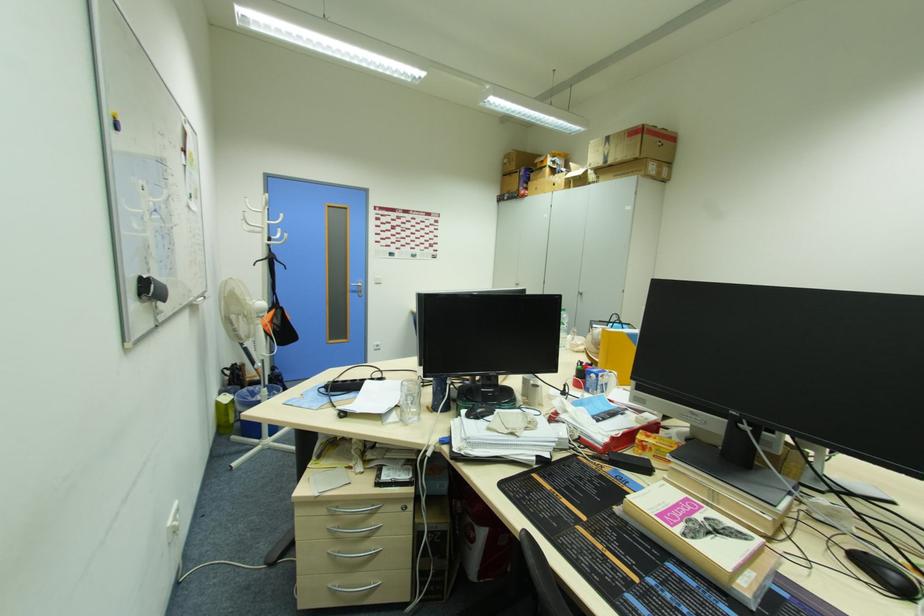
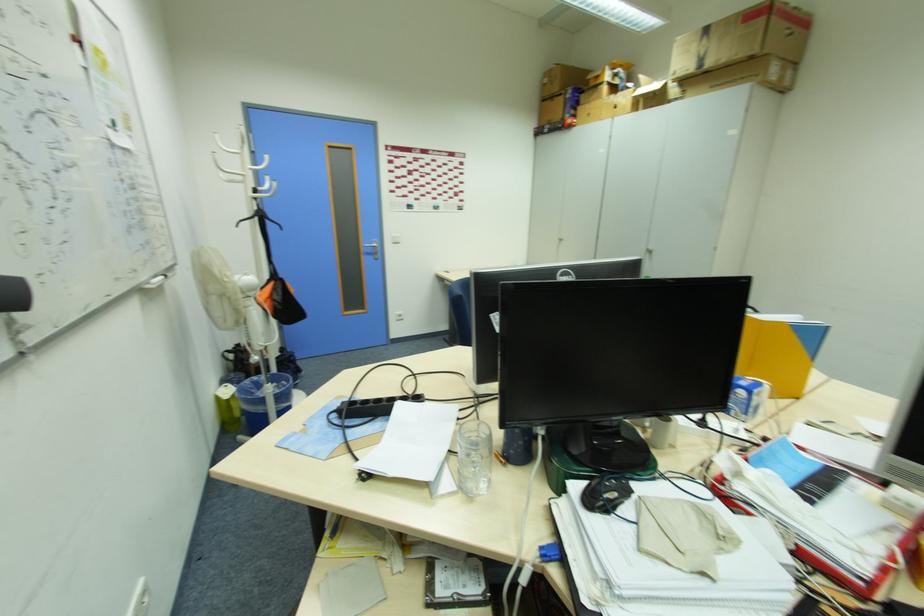
In the second image, find the point that corresponds to pixel 594 166 in the first image.

(685, 71)